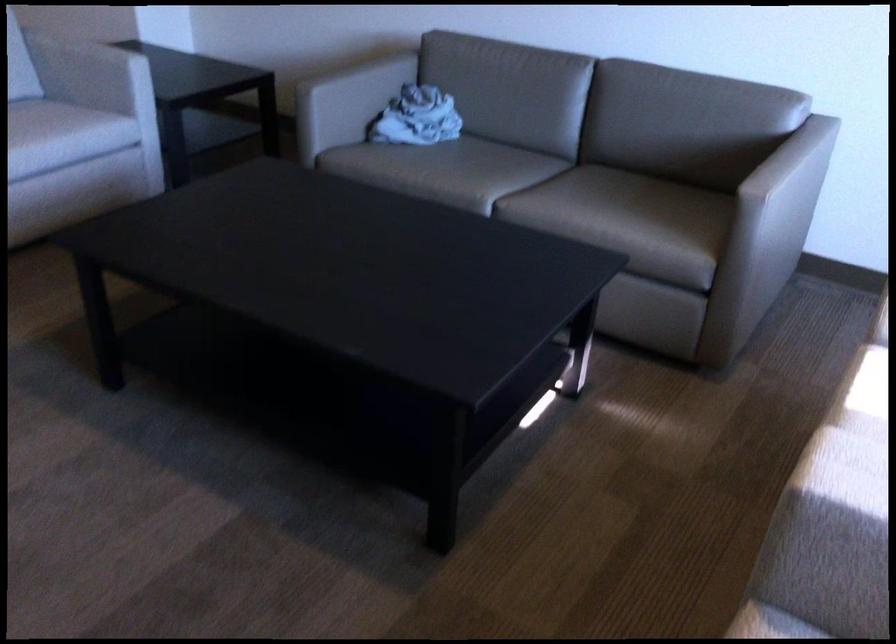
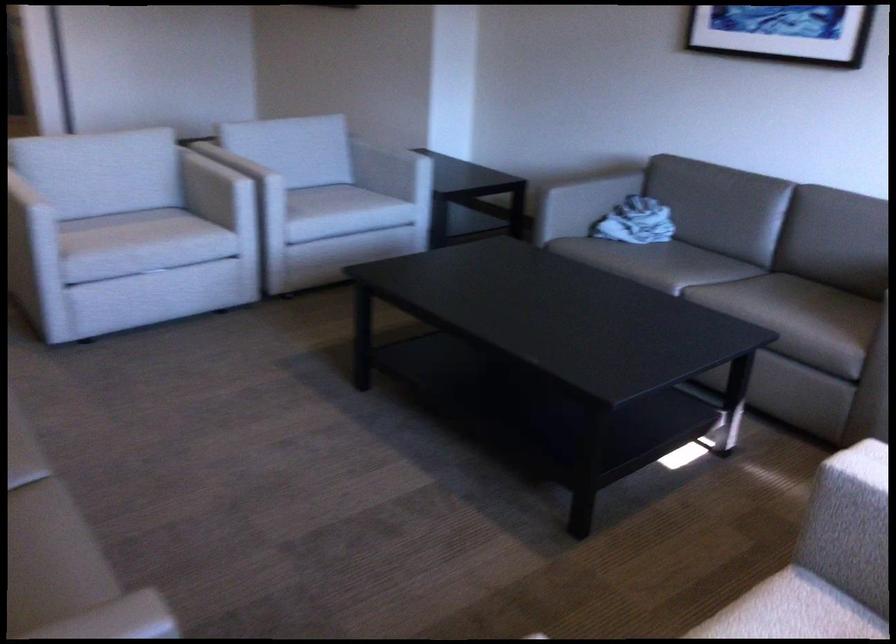
Question: The images are taken continuously from a first-person perspective. In which direction are you moving?

Choices:
 (A) Left
 (B) Right
 (C) Forward
 (D) Backward

Answer: (D)